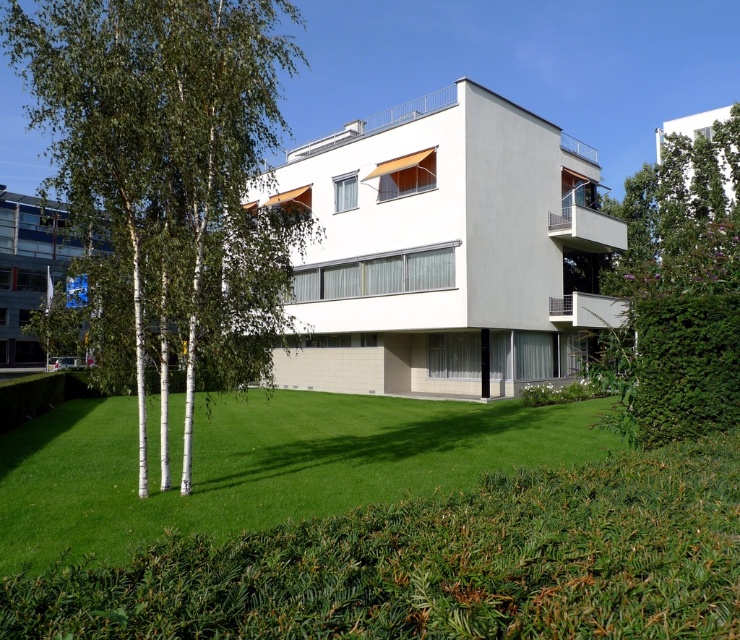
Based on the photo, how distant is green leafy tree at left from green leafy tree at upper right?

A distance of 27.11 meters exists between green leafy tree at left and green leafy tree at upper right.

Does point (178, 67) come closer to viewer compared to point (727, 300)?

No.

The width and height of the screenshot is (740, 640). What are the coordinates of `green leafy tree at left` in the screenshot? It's located at (169, 172).